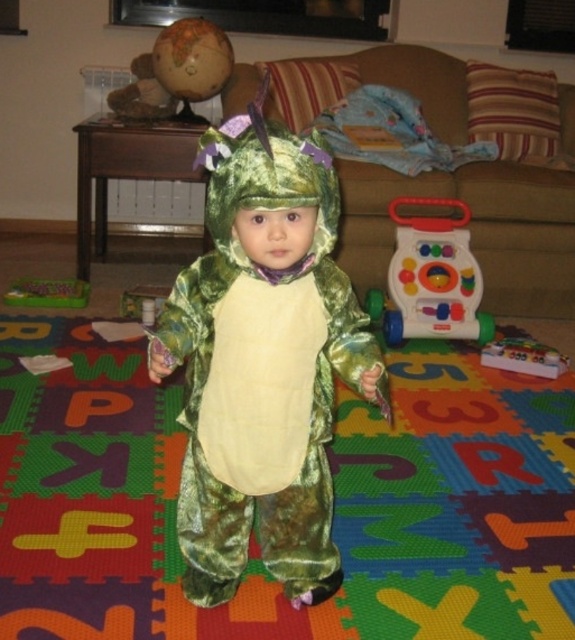
Question: Is multicolored plastic walker at center to the right of green plastic toy at lower left from the viewer's perspective?

Choices:
 (A) yes
 (B) no

Answer: (A)

Question: Does multicolored plastic toy at lower right lie in front of green plastic toy at lower left?

Choices:
 (A) yes
 (B) no

Answer: (A)

Question: Does velvet green costume at center appear on the left side of green plastic toy at lower left?

Choices:
 (A) yes
 (B) no

Answer: (B)

Question: Among these objects, which one is farthest from the camera?

Choices:
 (A) multicolored plastic walker at center
 (B) green plastic toy at lower left

Answer: (B)

Question: Which of the following is the closest to the observer?

Choices:
 (A) multicolored plastic walker at center
 (B) velvet green costume at center
 (C) green plastic toy at lower left
 (D) multicolored plastic toy at lower right

Answer: (B)

Question: Which object is closer to the camera taking this photo?

Choices:
 (A) green plastic toy at lower left
 (B) velvet green costume at center

Answer: (B)